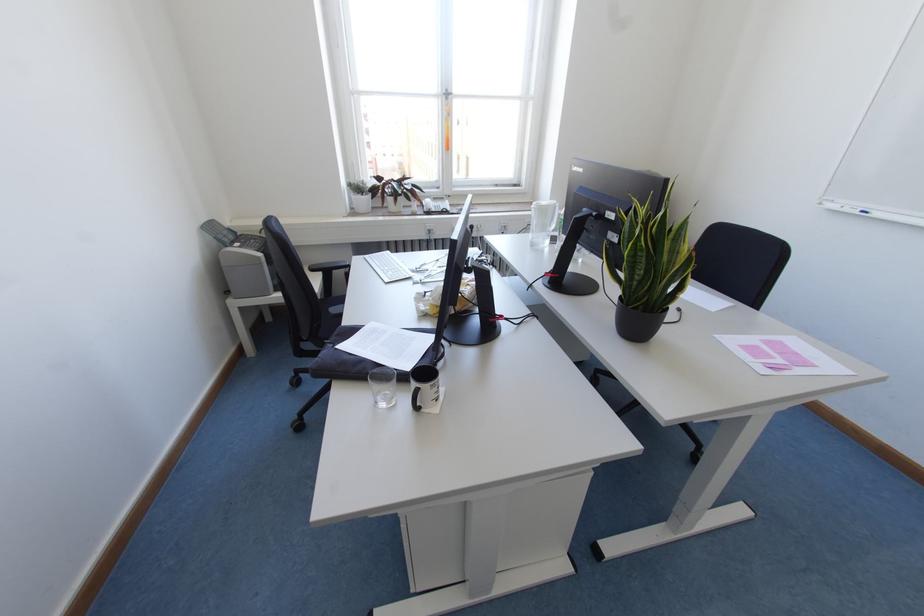
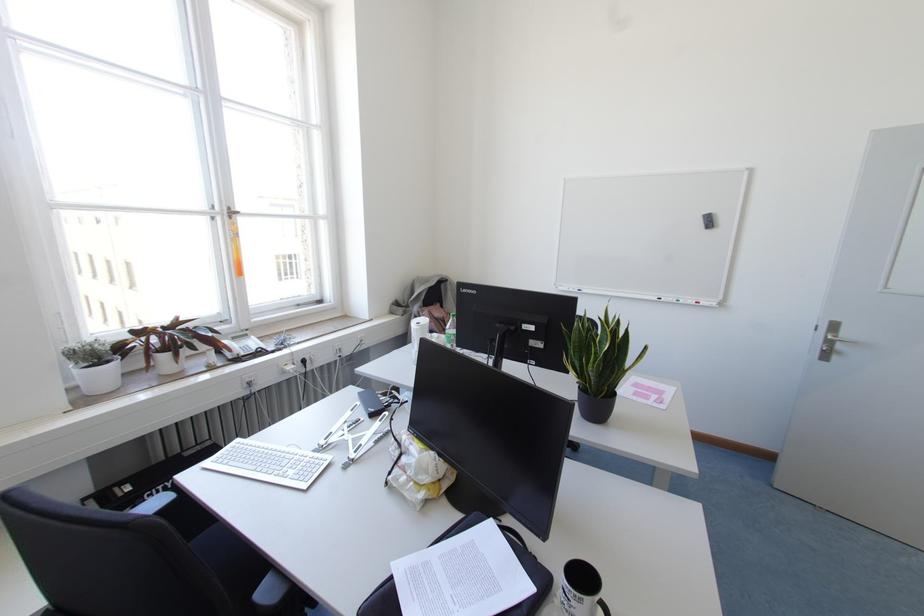
In the second image, find the point that corresponds to the point at 864,213 in the first image.

(578, 290)